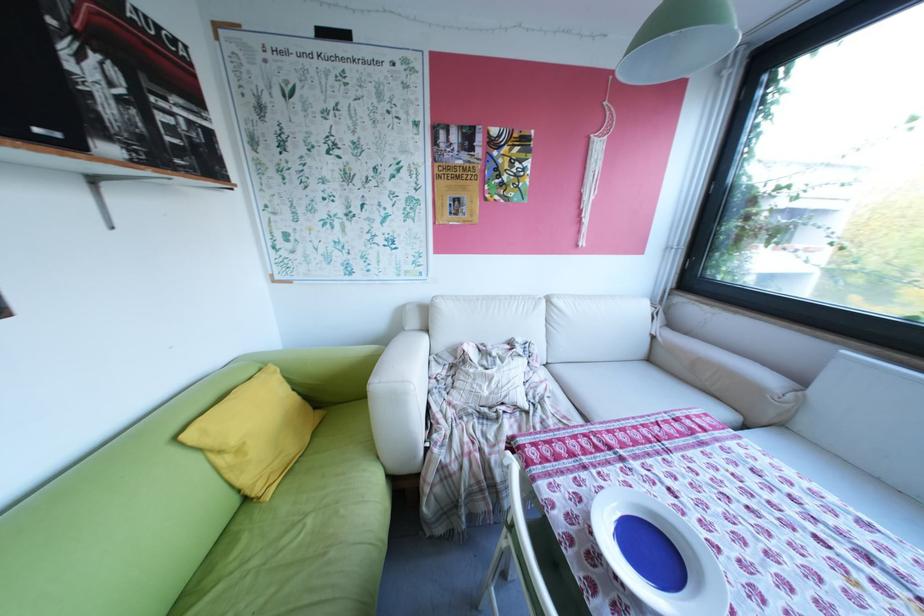
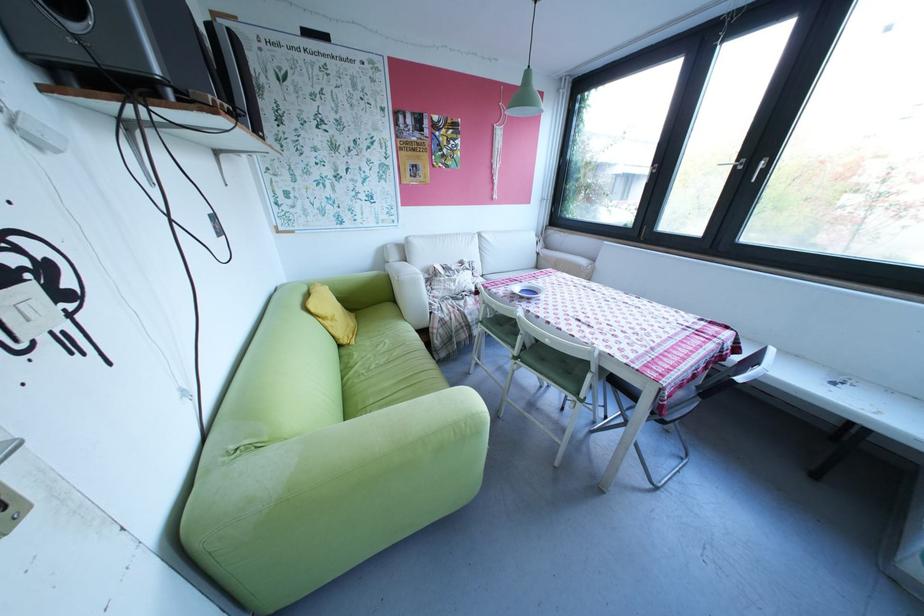
Question: I am providing you with two images of the same scene from different viewpoints. Which of the following objects are not visible in image2?

Choices:
 (A) yellow pillow
 (B) green sofa armrest
 (C) blue bowl
 (D) none of these

Answer: (D)